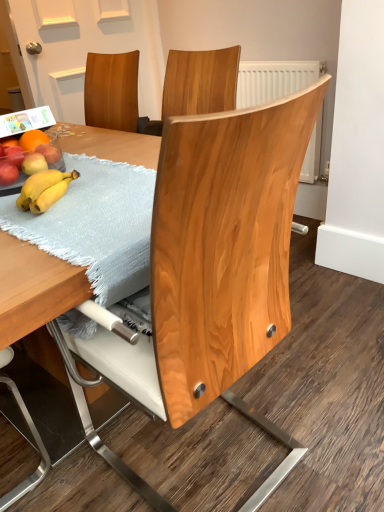
Identify the location of unoccupied area behind matte red apple at left, marked as the first apple in a back-to-front arrangement. Image resolution: width=384 pixels, height=512 pixels. (74, 152).